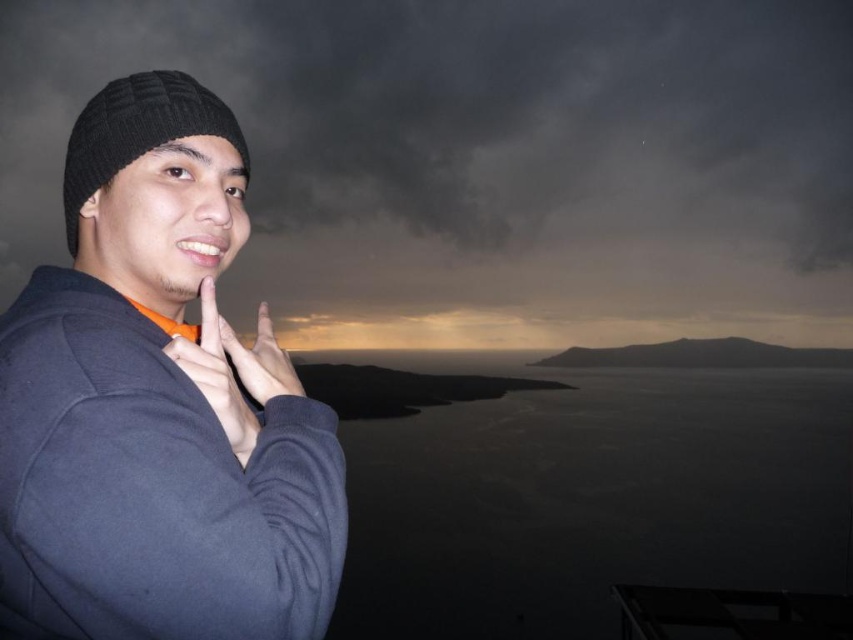
How distant is dark matte water at lower right from matte black hand at center?

The distance of dark matte water at lower right from matte black hand at center is 557.35 feet.

How distant is dark matte water at lower right from matte black hand at center?

dark matte water at lower right and matte black hand at center are 557.35 feet apart from each other.

Does point (555, 476) come behind point (244, 356)?

Yes, point (555, 476) is farther from viewer.

Identify the location of dark matte water at lower right. (590, 497).

Is knitted wool beanie at left smaller than matte black hand at center?

Actually, knitted wool beanie at left might be larger than matte black hand at center.

Can you confirm if knitted wool beanie at left is shorter than matte black hand at center?

In fact, knitted wool beanie at left may be taller than matte black hand at center.

Between point (283, 444) and point (225, 333), which one is positioned behind?

The point (225, 333) is behind.

Where is `knitted wool beanie at left`? knitted wool beanie at left is located at coordinates (155, 404).

How distant is dark matte water at lower right from black knitted hat at left?

dark matte water at lower right is 414.62 feet away from black knitted hat at left.

Is dark matte water at lower right to the right of black knitted hat at left from the viewer's perspective?

Correct, you'll find dark matte water at lower right to the right of black knitted hat at left.

Which is in front, point (718, 467) or point (206, 92)?

Positioned in front is point (206, 92).

This screenshot has width=853, height=640. Find the location of `dark matte water at lower right`. dark matte water at lower right is located at coordinates (590, 497).